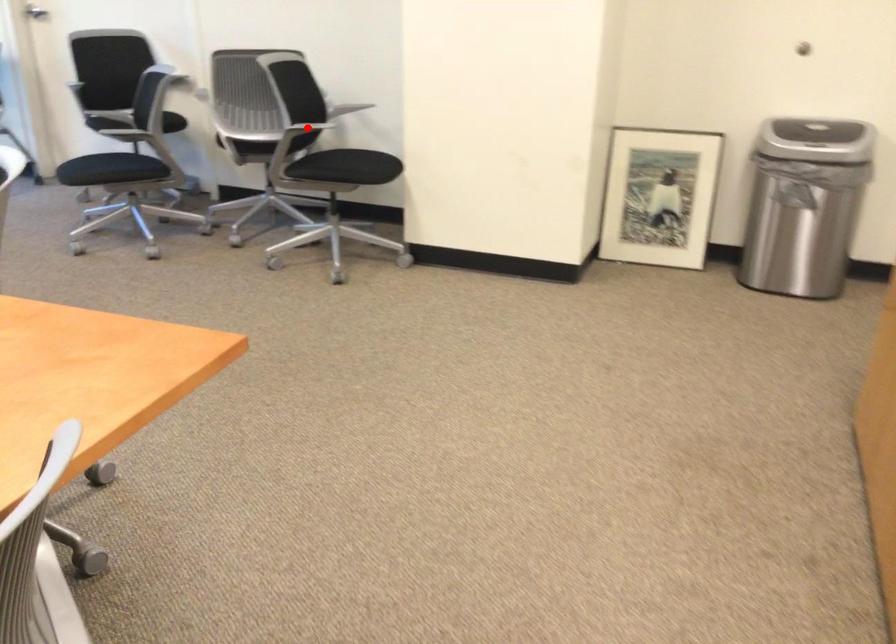
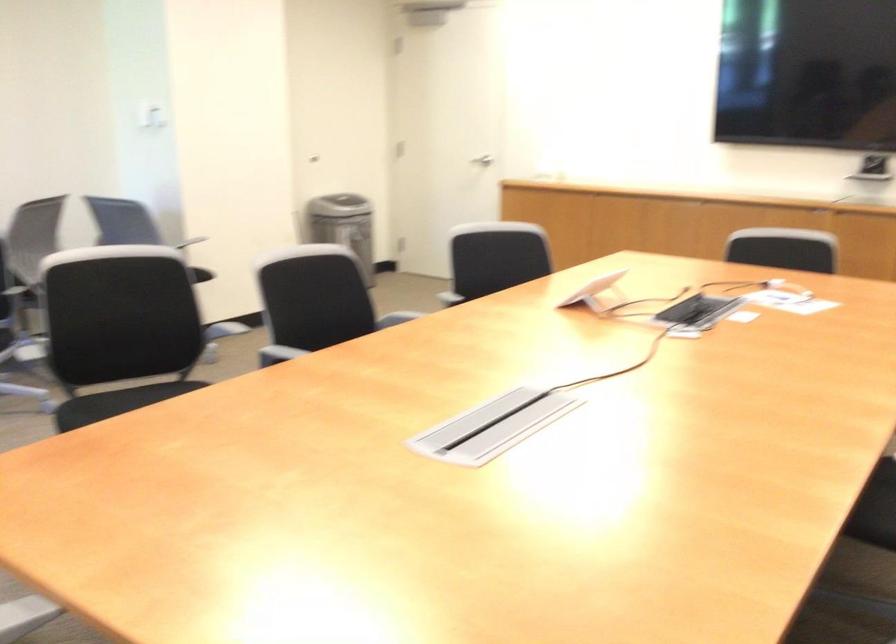
Question: I am providing you with two images of the same scene from different viewpoints. A red point is marked on the first image. Can you still see the location of the red point in image 2?

Choices:
 (A) Yes
 (B) No

Answer: (B)